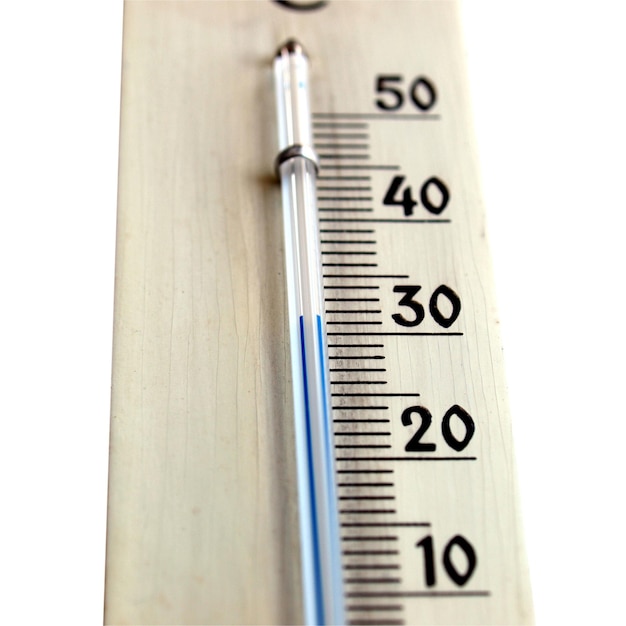
Where is `cracked wooden surface`? Image resolution: width=626 pixels, height=626 pixels. cracked wooden surface is located at coordinates (454, 369), (239, 245).